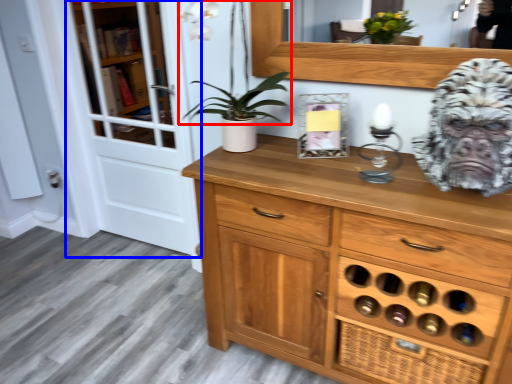
Question: Among these objects, which one is farthest to the camera, plant (highlighted by a red box) or screen door (highlighted by a blue box)?

Choices:
 (A) plant
 (B) screen door

Answer: (B)